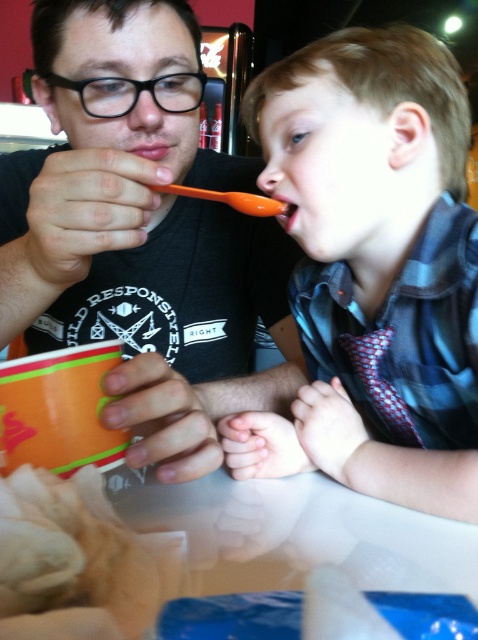
Based on the scene, where is the matte orange spoon at upper right located relative to the point marked at coordinates (x=373, y=269)?

The point marked at coordinates (x=373, y=269) indicates the location of the matte orange spoon at upper right.

Looking at this image, what are the coordinates of the matte orange spoon at upper right?

The matte orange spoon at upper right is located at coordinates point (373, 269).